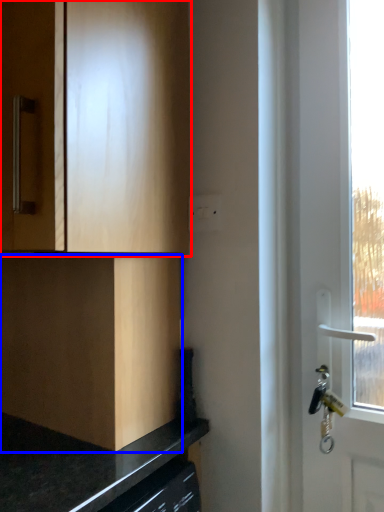
Question: Which object is closer to the camera taking this photo, cabinetry (highlighted by a red box) or cabinetry (highlighted by a blue box)?

Choices:
 (A) cabinetry
 (B) cabinetry

Answer: (A)